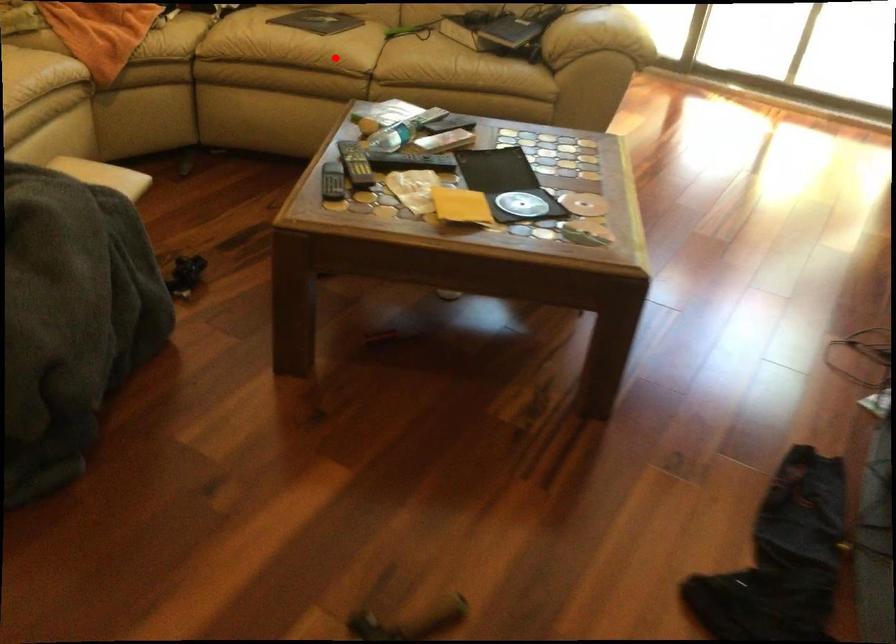
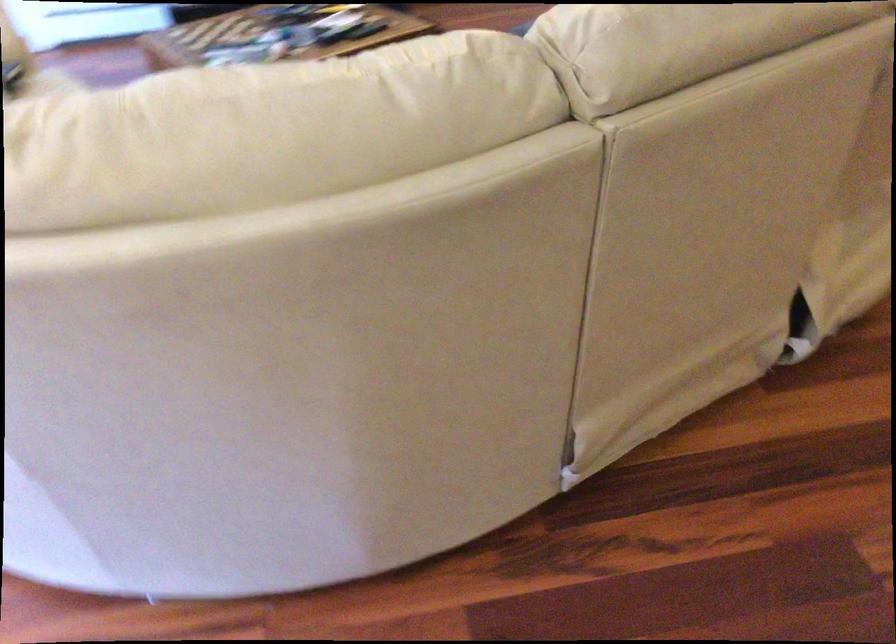
Question: I am providing you with two images of the same scene from different viewpoints. A red point is marked on the first image. Is the red point's position out of view in image 2?

Choices:
 (A) Yes
 (B) No

Answer: (A)